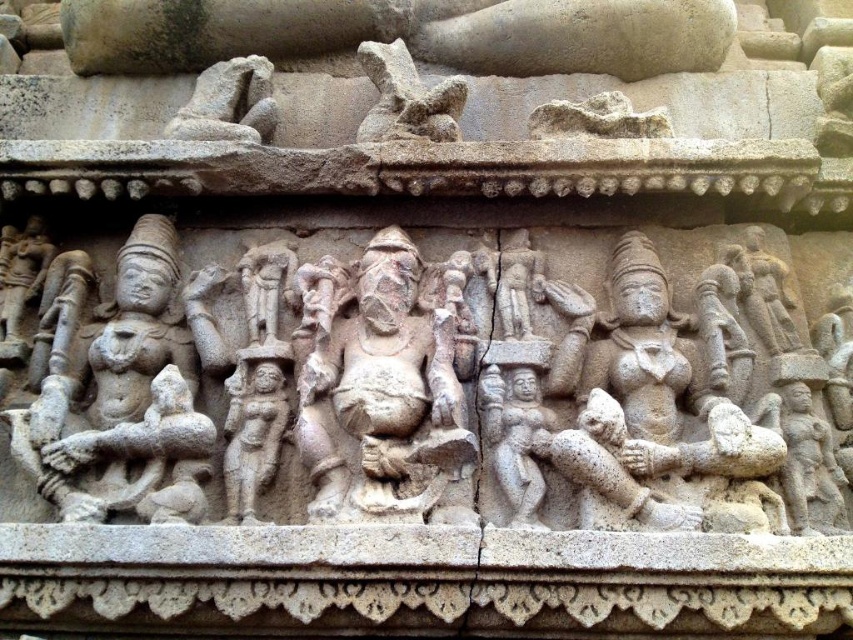
You are an archaeologist examining the stone carvings in the temple. You notice two carvings, the stone carving of deities at center and the gray stone carving at upper center. Which one do you think is wider?

The stone carving of deities at center is wider than the gray stone carving at upper center.

You are an art conservator standing 10 feet away from the stone carving of deities at center. Can you reach it to apply a protective coating without moving closer?

The stone carving of deities at center is 9.75 feet away from the viewer, so you are standing slightly farther away than the distance required. To apply the protective coating, you would need to move closer to ensure proper reach.

You are an archaeologist examining the stone carvings in the temple. You notice two carvings of interest. The first is the stone carving of deities at center, and the second is the gray stone carving at upper center. Based on their positions, which carving is positioned higher up in the image?

The gray stone carving at upper center is positioned higher up in the image than the stone carving of deities at center.